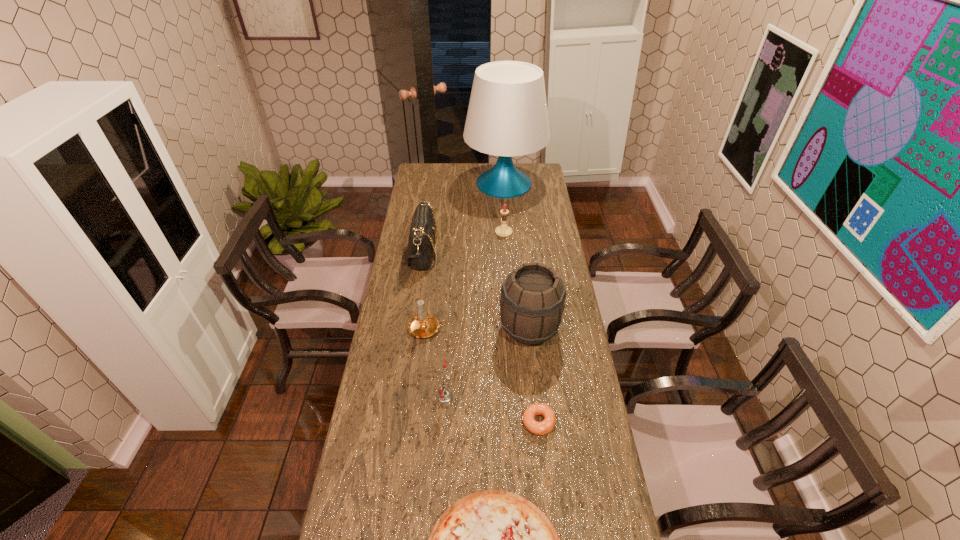
Where is `doughnut positioned at the right edge`? doughnut positioned at the right edge is located at coordinates (538, 428).

Where is `object located in the far right corner section of the desktop`? Image resolution: width=960 pixels, height=540 pixels. object located in the far right corner section of the desktop is located at coordinates (507, 116).

The height and width of the screenshot is (540, 960). In the image, there is a desktop. What are the coordinates of `vacant space at the left edge` in the screenshot? It's located at (409, 427).

What are the coordinates of `free space at the right edge of the desktop` in the screenshot? It's located at (x=573, y=359).

The width and height of the screenshot is (960, 540). What are the coordinates of `vacant space at the far right corner` in the screenshot? It's located at (545, 168).

This screenshot has width=960, height=540. In order to click on vacant area that lies between the third tallest object and the farthest candle in this screenshot , I will do `click(463, 242)`.

I want to click on free space between the second nearest candle and the nearest candle, so [436, 362].

Find the location of a particular element. empty space between the second nearest candle and the farthest object is located at coordinates (467, 256).

I want to click on empty space that is in between the second nearest candle and the farthest candle, so click(x=466, y=280).

The image size is (960, 540). Find the location of `unoccupied area between the farthest candle and the nearest candle`. unoccupied area between the farthest candle and the nearest candle is located at coordinates (474, 314).